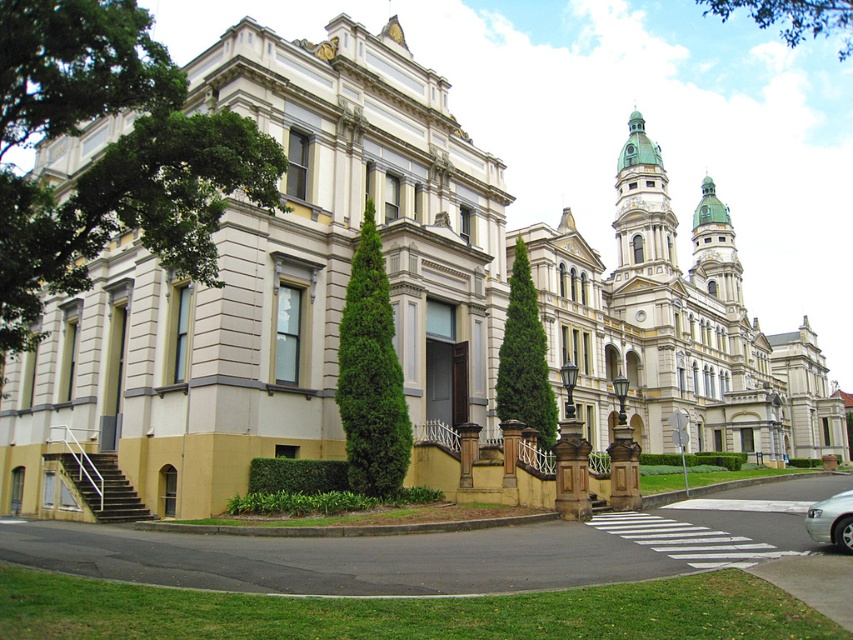
You are standing at the entrance of the grand historic building and want to plant a new tree exactly where the green coniferous tree at center is currently located. What are the coordinates where you should plant the new tree?

The coordinates for planting the new tree should be at point (370,374), where the green coniferous tree at center is currently located.

You are standing at the base of the stairs leading to the entrance of the grand historic building. You want to visit the white stone church at upper center. Given that the distance between you and the church is 89.31 meters, can you walk there in under 2 minutes if your walking speed is 1.5 meters per second?

The distance between you and the white stone church at upper center is 89.31 meters. At a walking speed of 1.5 meters per second, it would take approximately 59.54 seconds, which is under 2 minutes. Therefore, you can walk to the white stone church at upper center in under 2 minutes.

You are standing at the entrance of the historic building and want to take a photo that includes both the green leafy tree at left and the two tall conical evergreen trees flanking the entrance. Which direction should you face to ensure both sets of trees are in the frame?

The green leafy tree at left is located at point (x=109, y=154), so you should face towards the left side of the entrance to include both the green leafy tree at left and the two tall conical evergreen trees flanking the entrance in your photo.